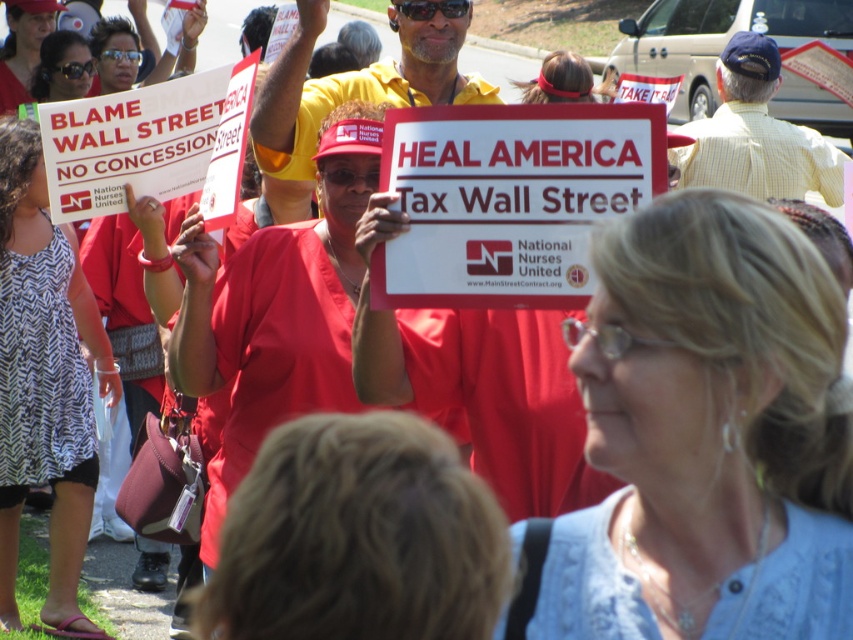
Question: Is blue lace shirt at center bigger than yellow matte shirt at center?

Choices:
 (A) no
 (B) yes

Answer: (A)

Question: Estimate the real-world distances between objects in this image. Which object is farther from the matte red shirt at center?

Choices:
 (A) matte red headband at center
 (B) blue lace shirt at center
 (C) yellow checkered shirt at upper right
 (D) white printed sign at center

Answer: (B)

Question: Which is farther from the matte red shirt at center?

Choices:
 (A) white paper sign at center
 (B) yellow checkered shirt at upper right
 (C) white printed sign at center

Answer: (A)

Question: Which point is closer to the camera taking this photo?

Choices:
 (A) (306, 282)
 (B) (563, 113)

Answer: (B)

Question: Is matte red scrubs at center positioned at the back of matte red shirt at center?

Choices:
 (A) yes
 (B) no

Answer: (B)

Question: Can you confirm if yellow matte shirt at center is wider than matte red headband at center?

Choices:
 (A) no
 (B) yes

Answer: (B)